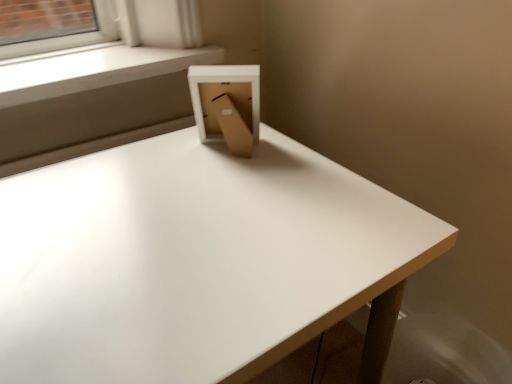
Question: Is cardboard box at center oriented away from white smooth window sill at upper left?

Choices:
 (A) yes
 (B) no

Answer: (B)

Question: Is cardboard box at center bigger than white smooth window sill at upper left?

Choices:
 (A) yes
 (B) no

Answer: (B)

Question: Is white smooth window sill at upper left inside cardboard box at center?

Choices:
 (A) yes
 (B) no

Answer: (B)

Question: Is cardboard box at center outside white smooth window sill at upper left?

Choices:
 (A) no
 (B) yes

Answer: (B)

Question: From the image's perspective, is cardboard box at center beneath white smooth window sill at upper left?

Choices:
 (A) yes
 (B) no

Answer: (A)

Question: From a real-world perspective, is cardboard box at center positioned above or below white matte table at center?

Choices:
 (A) above
 (B) below

Answer: (A)

Question: Choose the correct answer: Is cardboard box at center inside white matte table at center or outside it?

Choices:
 (A) outside
 (B) inside

Answer: (A)

Question: Based on their positions, is cardboard box at center located to the left or right of white matte table at center?

Choices:
 (A) left
 (B) right

Answer: (B)

Question: Relative to white matte table at center, is cardboard box at center in front or behind?

Choices:
 (A) behind
 (B) front

Answer: (A)

Question: Is white matte table at center bigger or smaller than white smooth window sill at upper left?

Choices:
 (A) small
 (B) big

Answer: (B)

Question: From a real-world perspective, relative to white smooth window sill at upper left, is white matte table at center vertically above or below?

Choices:
 (A) below
 (B) above

Answer: (A)

Question: Considering their positions, is white matte table at center located in front of or behind white smooth window sill at upper left?

Choices:
 (A) front
 (B) behind

Answer: (A)

Question: Is point (67, 349) closer or farther from the camera than point (143, 46)?

Choices:
 (A) closer
 (B) farther

Answer: (A)

Question: From their relative heights in the image, would you say white smooth window sill at upper left is taller or shorter than white matte table at center?

Choices:
 (A) tall
 (B) short

Answer: (B)

Question: Is white smooth window sill at upper left to the left or to the right of white matte table at center in the image?

Choices:
 (A) right
 (B) left

Answer: (B)